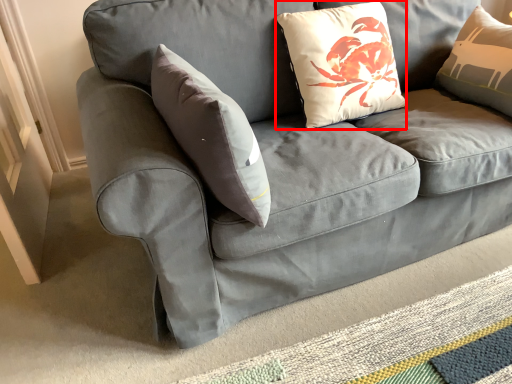
Question: From the image, what is the correct spatial relationship of pillow (annotated by the red box) in relation to mat?

Choices:
 (A) right
 (B) left

Answer: (B)